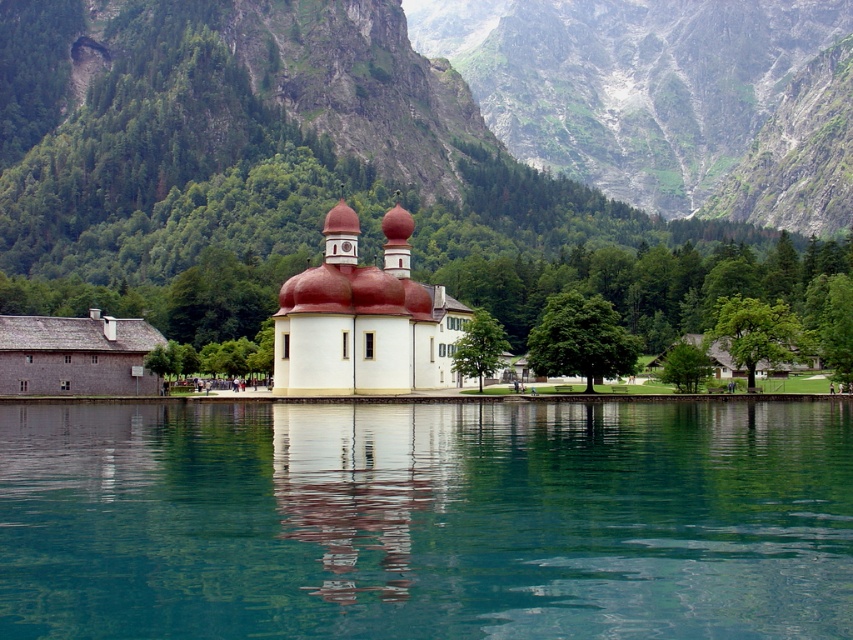
Between clear glass water at center and white matte chapel at center, which one appears on the right side from the viewer's perspective?

clear glass water at center is more to the right.

Does point (467, 582) come closer to viewer compared to point (373, 376)?

Yes, it is in front of point (373, 376).

Between point (738, 611) and point (389, 252), which one is positioned in front?

Point (738, 611)

Find the location of `clear glass water at center`. clear glass water at center is located at coordinates (425, 518).